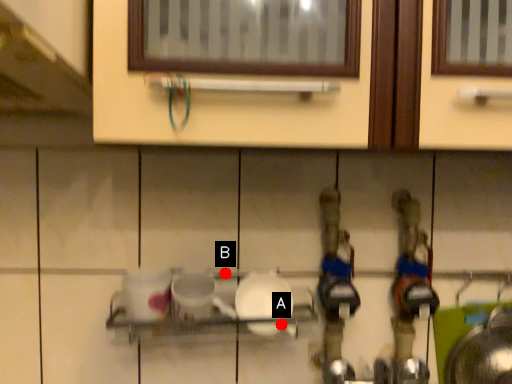
Question: Two points are circled on the image, labeled by A and B beside each circle. Among these points, which one is farthest from the camera?

Choices:
 (A) A is further
 (B) B is further

Answer: (B)